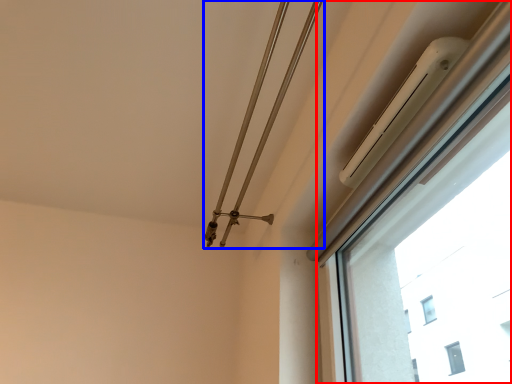
Question: Which of the following is the closest to the observer, window (highlighted by a red box) or twin (highlighted by a blue box)?

Choices:
 (A) window
 (B) twin

Answer: (A)